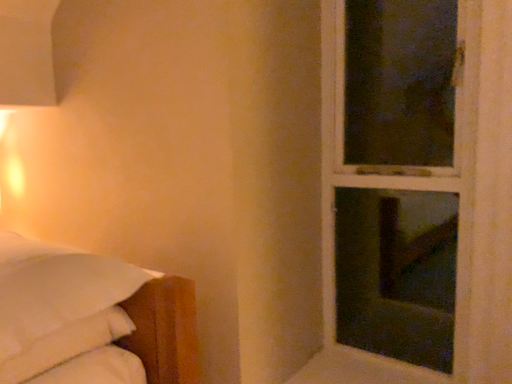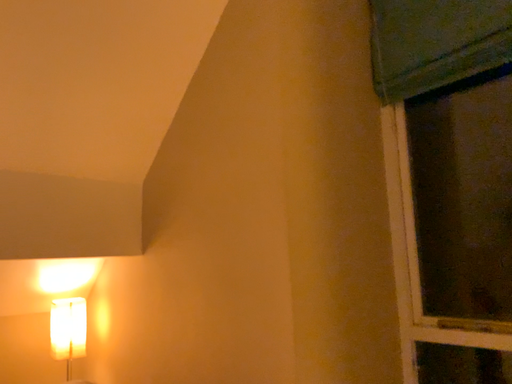
Question: Which way did the camera rotate in the video?

Choices:
 (A) rotated downward
 (B) rotated upward

Answer: (B)